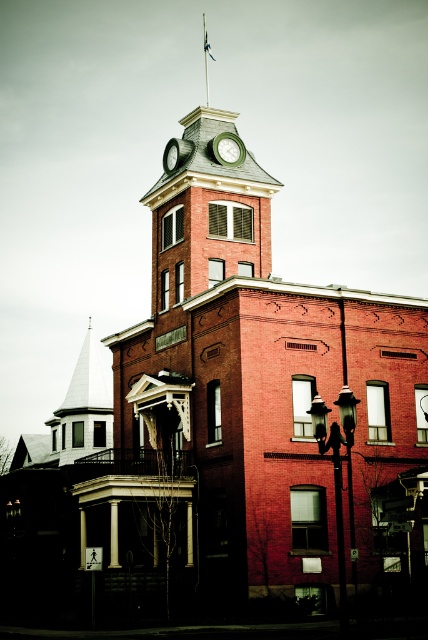
Consider the image. Who is positioned more to the right, green matte clock at upper center or green metallic clock at center?

Positioned to the right is green matte clock at upper center.

Does green matte clock at upper center have a larger size compared to green metallic clock at center?

Correct, green matte clock at upper center is larger in size than green metallic clock at center.

The width and height of the screenshot is (428, 640). Describe the element at coordinates (228, 148) in the screenshot. I see `green matte clock at upper center` at that location.

Where is `green matte clock at upper center`? green matte clock at upper center is located at coordinates (228, 148).

Does white spire at left lie in front of green matte clock at upper center?

No, it is behind green matte clock at upper center.

Where is `white spire at left`? The image size is (428, 640). white spire at left is located at coordinates (86, 381).

Does white spire at left have a lesser width compared to green metallic clock at center?

In fact, white spire at left might be wider than green metallic clock at center.

Who is positioned more to the right, white spire at left or green metallic clock at center?

Positioned to the right is green metallic clock at center.

What do you see at coordinates (86, 381) in the screenshot?
I see `white spire at left` at bounding box center [86, 381].

Find the location of a particular element. The width and height of the screenshot is (428, 640). white spire at left is located at coordinates (86, 381).